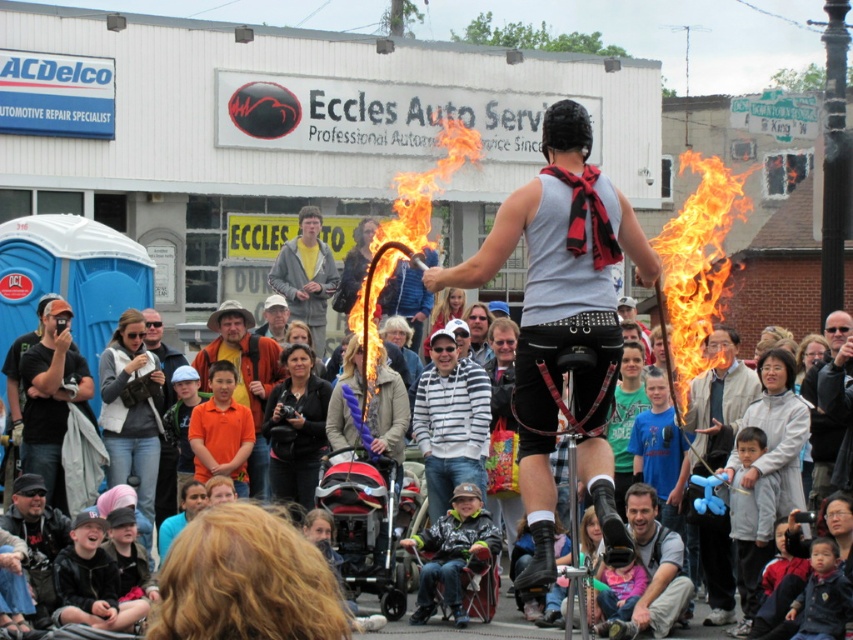
Question: Does matte black shorts at center appear on the left side of black leather jacket at upper left?

Choices:
 (A) yes
 (B) no

Answer: (B)

Question: Which of the following is the farthest from the observer?

Choices:
 (A) flameflame at center
 (B) striped cotton hoodie at center

Answer: (B)

Question: From the image, what is the correct spatial relationship of matte gray tank top at center in relation to flameflame at center?

Choices:
 (A) right
 (B) left

Answer: (A)

Question: Can you confirm if orange cotton shirt at center is positioned to the left of yellow t-shirt at center?

Choices:
 (A) yes
 (B) no

Answer: (B)

Question: Which point is farther to the camera?

Choices:
 (A) (616, 228)
 (B) (352, 308)
 (C) (194, 454)
 (D) (254, 380)

Answer: (B)

Question: Which object is farther from the camera taking this photo?

Choices:
 (A) orange cotton shirt at center
 (B) flameflame at center
 (C) black fabric camera at center

Answer: (C)